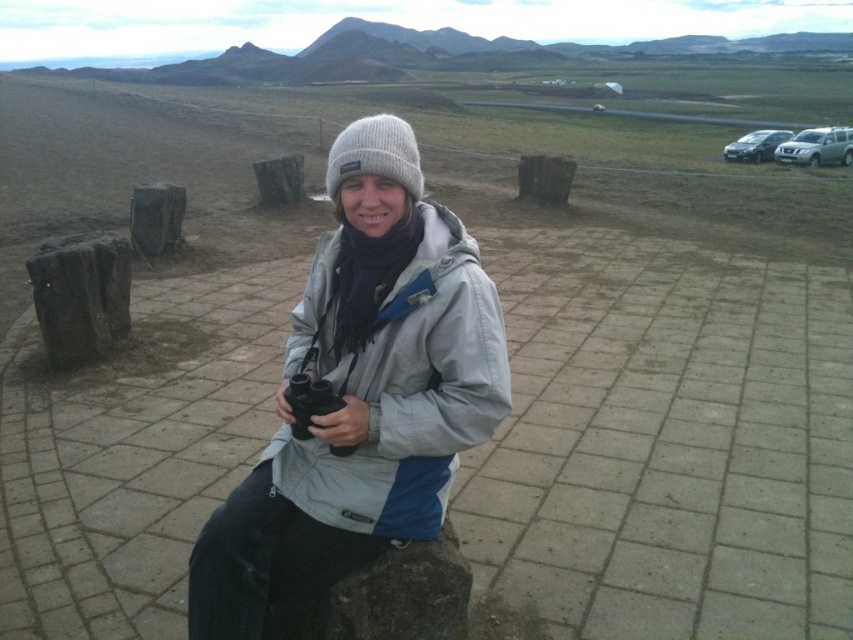
Find the location of a particular element. Image resolution: width=853 pixels, height=640 pixels. satin silver suv at upper right is located at coordinates (817, 147).

Image resolution: width=853 pixels, height=640 pixels. Find the location of `satin silver suv at upper right`. satin silver suv at upper right is located at coordinates (817, 147).

Is black rubber binoculars at center in front of satin silver sedan at upper right?

Yes.

Is black rubber binoculars at center further to camera compared to satin silver sedan at upper right?

That is False.

Is point (303, 376) in front of point (755, 145)?

Yes, it is in front of point (755, 145).

The height and width of the screenshot is (640, 853). In order to click on black rubber binoculars at center in this screenshot , I will do `click(309, 401)`.

Between gray fleece jacket at center and black rubber binoculars at center, which one has less height?

black rubber binoculars at center is shorter.

Does point (357, 476) lie in front of point (332, 412)?

No, (357, 476) is behind (332, 412).

Find the location of a particular element. gray fleece jacket at center is located at coordinates (361, 394).